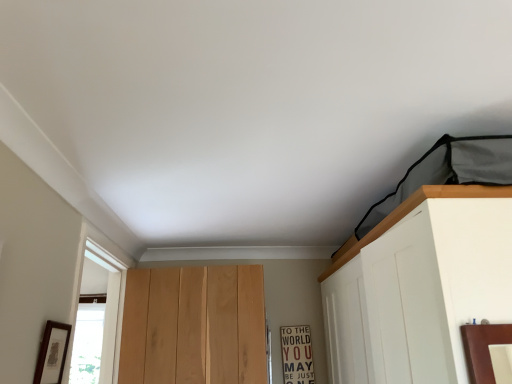
The height and width of the screenshot is (384, 512). What do you see at coordinates (297, 354) in the screenshot?
I see `wooden sign at center` at bounding box center [297, 354].

The width and height of the screenshot is (512, 384). In order to click on wooden sign at center in this screenshot , I will do `click(297, 354)`.

Describe the element at coordinates (52, 353) in the screenshot. I see `matte black picture frame at lower left` at that location.

Where is `matte black picture frame at lower left`? The height and width of the screenshot is (384, 512). matte black picture frame at lower left is located at coordinates point(52,353).

Measure the distance between matte black picture frame at lower left and camera.

matte black picture frame at lower left and camera are 4.19 feet apart from each other.

You are a GUI agent. You are given a task and a screenshot of the screen. Output one action in this format:
    pyautogui.click(x=<x>, y=<y>)
    Task: Click on the wooden sign at center
    The height and width of the screenshot is (384, 512).
    Given the screenshot: What is the action you would take?
    pyautogui.click(x=297, y=354)

Considering the positions of objects wooden sign at center and matte black picture frame at lower left in the image provided, who is more to the left, wooden sign at center or matte black picture frame at lower left?

matte black picture frame at lower left is more to the left.

Between wooden sign at center and matte black picture frame at lower left, which one is positioned in front?

matte black picture frame at lower left is in front.

Which is farther from the camera, [284,377] or [63,329]?

Point [284,377]

From the image's perspective, is wooden sign at center located beneath matte black picture frame at lower left?

Correct, wooden sign at center appears lower than matte black picture frame at lower left in the image.

From a real-world perspective, between wooden sign at center and matte black picture frame at lower left, who is vertically higher?

In real-world perspective, matte black picture frame at lower left is above.

Can you confirm if wooden sign at center is wider than matte black picture frame at lower left?

Yes, wooden sign at center is wider than matte black picture frame at lower left.

Can you confirm if wooden sign at center is shorter than matte black picture frame at lower left?

Incorrect, the height of wooden sign at center does not fall short of that of matte black picture frame at lower left.

Considering the sizes of objects wooden sign at center and matte black picture frame at lower left in the image provided, who is bigger, wooden sign at center or matte black picture frame at lower left?

Bigger between the two is wooden sign at center.

Is wooden sign at center positioned beyond the bounds of matte black picture frame at lower left?

Yes.

Looking at this image, are wooden sign at center and matte black picture frame at lower left located far from each other?

Yes, wooden sign at center and matte black picture frame at lower left are located far from each other.

Is wooden sign at center oriented towards matte black picture frame at lower left?

No, wooden sign at center is not turned towards matte black picture frame at lower left.

How many degrees apart are the facing directions of wooden sign at center and matte black picture frame at lower left?

The angle between the facing direction of wooden sign at center and the facing direction of matte black picture frame at lower left is 90.1 degrees.

Find the location of `warning sign that appears behind the matte black picture frame at lower left`. warning sign that appears behind the matte black picture frame at lower left is located at coordinates (297, 354).

Does matte black picture frame at lower left appear on the left side of wooden sign at center?

Correct, you'll find matte black picture frame at lower left to the left of wooden sign at center.

Is matte black picture frame at lower left further to the viewer compared to wooden sign at center?

No, matte black picture frame at lower left is closer to the camera.

Considering the positions of points (53, 344) and (309, 373), is point (53, 344) closer to camera compared to point (309, 373)?

Yes, point (53, 344) is in front of point (309, 373).

From the image's perspective, is matte black picture frame at lower left below wooden sign at center?

Actually, matte black picture frame at lower left appears above wooden sign at center in the image.

From a real-world perspective, is matte black picture frame at lower left physically located above or below wooden sign at center?

In terms of real-world spatial position, matte black picture frame at lower left is above wooden sign at center.

In terms of width, does matte black picture frame at lower left look wider or thinner when compared to wooden sign at center?

Clearly, matte black picture frame at lower left has less width compared to wooden sign at center.

Between matte black picture frame at lower left and wooden sign at center, which one has less height?

Standing shorter between the two is matte black picture frame at lower left.

Who is smaller, matte black picture frame at lower left or wooden sign at center?

matte black picture frame at lower left is smaller.

Do you think matte black picture frame at lower left is within wooden sign at center, or outside of it?

matte black picture frame at lower left exists outside the volume of wooden sign at center.

Is matte black picture frame at lower left far away from wooden sign at center?

Yes, matte black picture frame at lower left and wooden sign at center are quite far apart.

Is matte black picture frame at lower left looking in the opposite direction of wooden sign at center?

No, matte black picture frame at lower left is not facing the opposite direction of wooden sign at center.

How different are the orientations of matte black picture frame at lower left and wooden sign at center in degrees?

The angular difference between matte black picture frame at lower left and wooden sign at center is 90.1 degrees.

How much distance is there between matte black picture frame at lower left and wooden sign at center?

matte black picture frame at lower left and wooden sign at center are 4.62 feet apart.

Find the location of `picture frame above the wooden sign at center (from the image's perspective)`. picture frame above the wooden sign at center (from the image's perspective) is located at coordinates (52, 353).

Find the location of a particular element. The height and width of the screenshot is (384, 512). picture frame that is above the wooden sign at center (from the image's perspective) is located at coordinates (52, 353).

I want to click on picture frame lying on the left of wooden sign at center, so click(x=52, y=353).